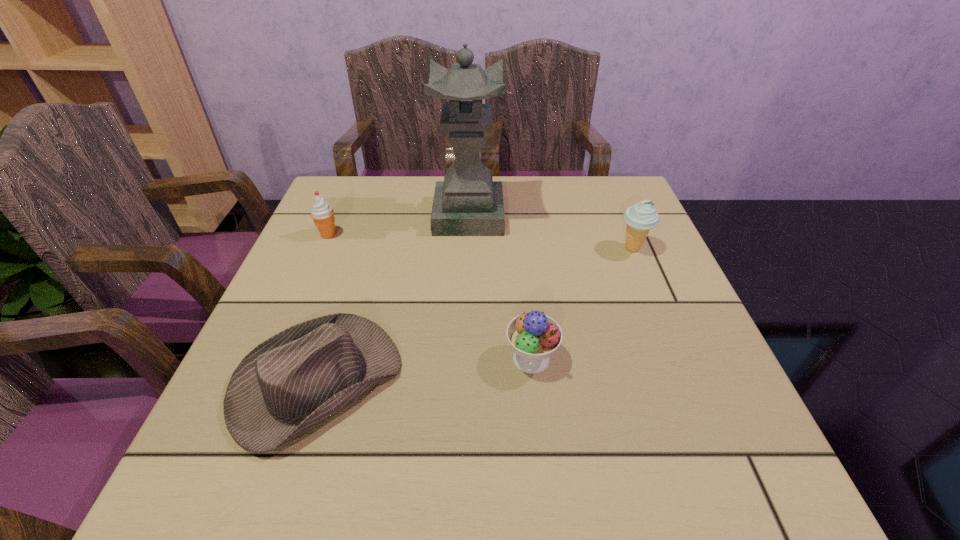
Identify the location of free point that satisfies the following two spatial constraints: 1. on the back side of the second icecream from left to right; 2. on the left side of the rightmost object. The image size is (960, 540). (519, 248).

Locate an element on the screen. The height and width of the screenshot is (540, 960). free space that satisfies the following two spatial constraints: 1. at the front opening of the second icecream from left to right; 2. on the right side of the sculpture is located at coordinates (464, 359).

Where is `free space that satisfies the following two spatial constraints: 1. on the front side of the second icecream from left to right; 2. on the left side of the leftmost icecream`? free space that satisfies the following two spatial constraints: 1. on the front side of the second icecream from left to right; 2. on the left side of the leftmost icecream is located at coordinates (276, 359).